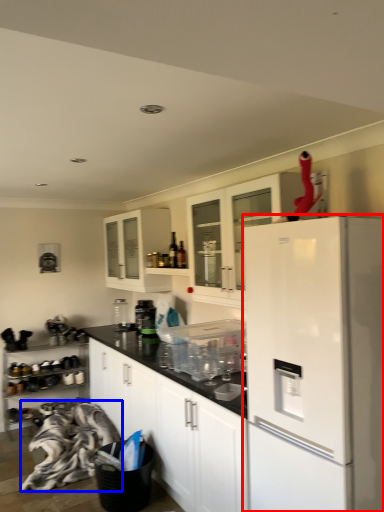
Question: Which object appears closest to the camera in this image, refrigerator (highlighted by a red box) or material (highlighted by a blue box)?

Choices:
 (A) refrigerator
 (B) material

Answer: (A)